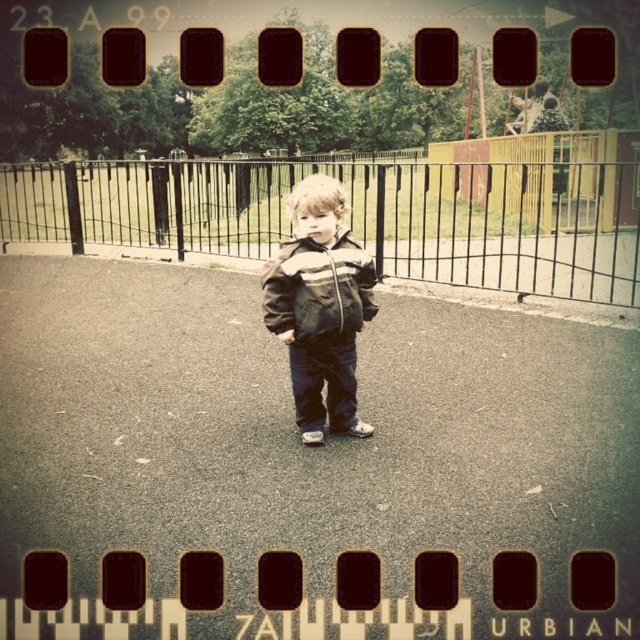
Can you confirm if black metal fence at center is taller than brown textured jacket at center?

Correct, black metal fence at center is much taller as brown textured jacket at center.

Is point (170, 237) less distant than point (317, 340)?

No.

Where is `black metal fence at center`? The image size is (640, 640). black metal fence at center is located at coordinates (362, 214).

Which of these two, black metal fence at center or striped fabric jacket at center, stands shorter?

Standing shorter between the two is striped fabric jacket at center.

Can you confirm if black metal fence at center is shorter than striped fabric jacket at center?

No, black metal fence at center is not shorter than striped fabric jacket at center.

Between point (172, 211) and point (284, 246), which one is positioned behind?

Point (172, 211)

You are a GUI agent. You are given a task and a screenshot of the screen. Output one action in this format:
    pyautogui.click(x=<x>, y=<y>)
    Task: Click on the black metal fence at center
    
    Given the screenshot: What is the action you would take?
    pyautogui.click(x=362, y=214)

Is brown textured jacket at center further to camera compared to striped fabric jacket at center?

No, brown textured jacket at center is in front of striped fabric jacket at center.

Can you confirm if brown textured jacket at center is smaller than striped fabric jacket at center?

No, brown textured jacket at center is not smaller than striped fabric jacket at center.

Which is behind, point (312, 184) or point (348, 266)?

Positioned behind is point (348, 266).

The height and width of the screenshot is (640, 640). Find the location of `brown textured jacket at center`. brown textured jacket at center is located at coordinates (321, 308).